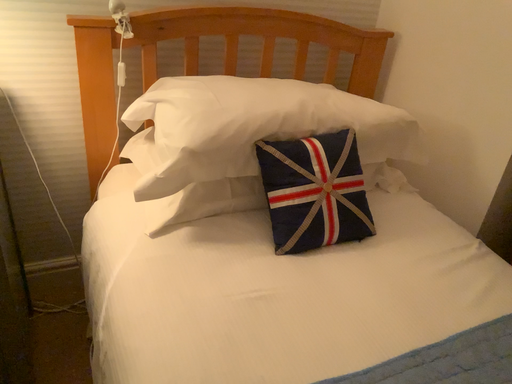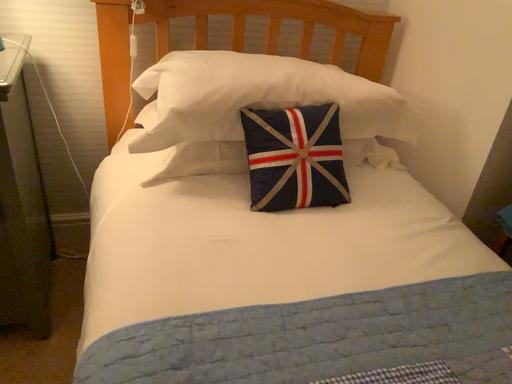
Question: How did the camera likely rotate when shooting the video?

Choices:
 (A) rotated right
 (B) rotated left

Answer: (B)